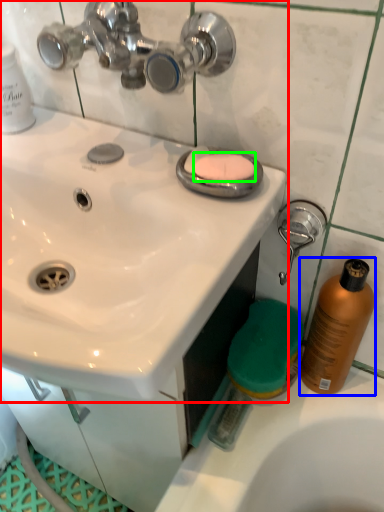
Question: Based on their relative distances, which object is nearer to sink (highlighted by a red box)? Choose from cleaning product (highlighted by a blue box) and soap (highlighted by a green box).

Choices:
 (A) cleaning product
 (B) soap

Answer: (B)